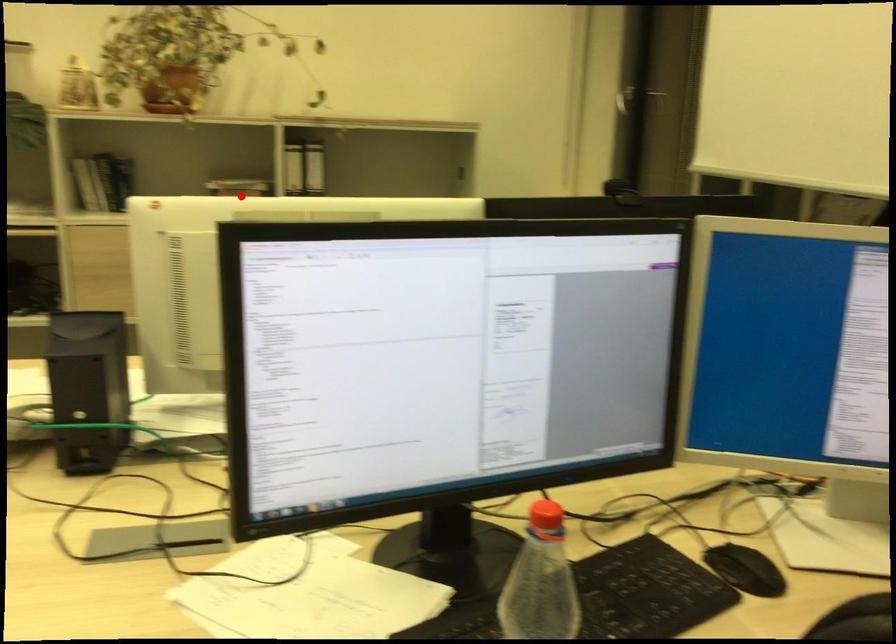
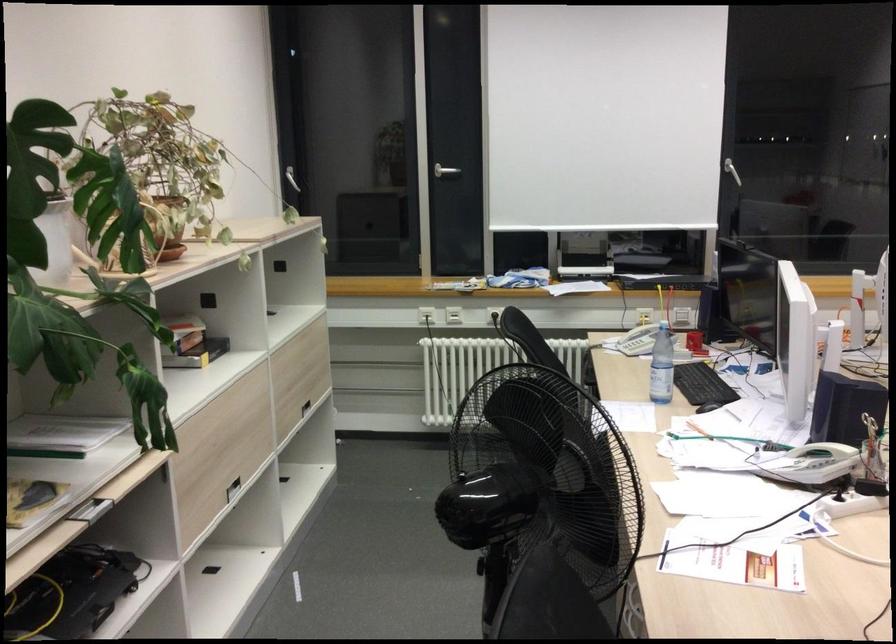
Where in the second image is the point corresponding to the highlighted location from the first image?

(192, 343)